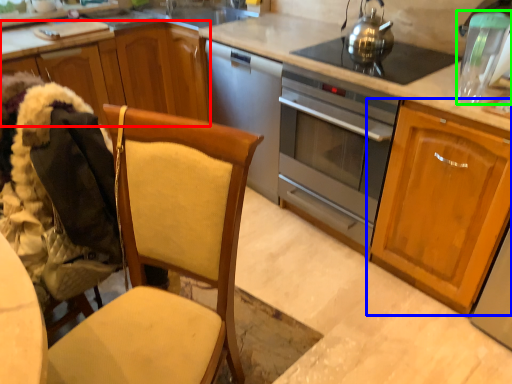
Question: Which is nearer to the cabinetry (highlighted by a red box)? cabinetry (highlighted by a blue box) or appliance (highlighted by a green box).

Choices:
 (A) cabinetry
 (B) appliance

Answer: (A)